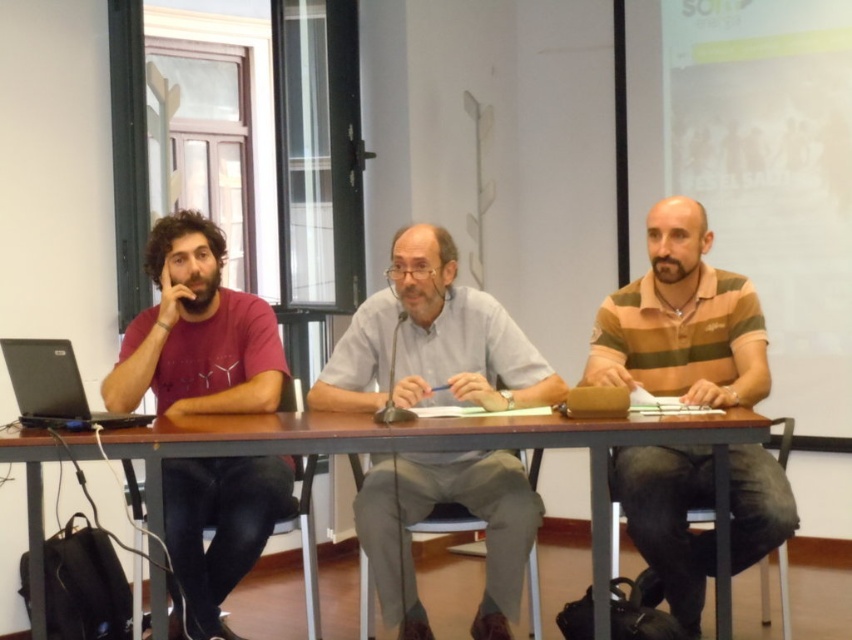
Question: Observing the image, what is the correct spatial positioning of striped cotton polo shirt at right in reference to brown wooden table at center?

Choices:
 (A) below
 (B) above

Answer: (B)

Question: Which object is the closest to the matte red shirt at left?

Choices:
 (A) gray cotton shirt at center
 (B) black plastic stool at lower right
 (C) brown wooden table at center

Answer: (C)

Question: From the image, what is the correct spatial relationship of gray cotton shirt at center in relation to matte red shirt at left?

Choices:
 (A) left
 (B) right

Answer: (B)

Question: Among these points, which one is farthest from the camera?

Choices:
 (A) (639, 461)
 (B) (26, 392)
 (C) (277, 376)

Answer: (C)

Question: Can you confirm if striped cotton polo shirt at right is thinner than black plastic stool at lower right?

Choices:
 (A) yes
 (B) no

Answer: (B)

Question: Which point is farther to the camera?

Choices:
 (A) light brown wooden stool at center
 (B) striped cotton polo shirt at right
 (C) brown wooden table at center

Answer: (A)